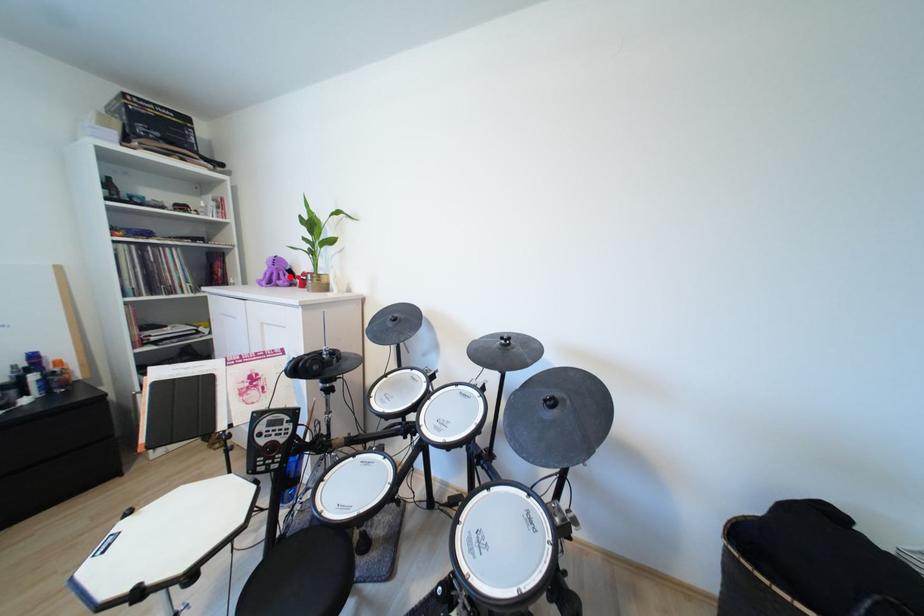
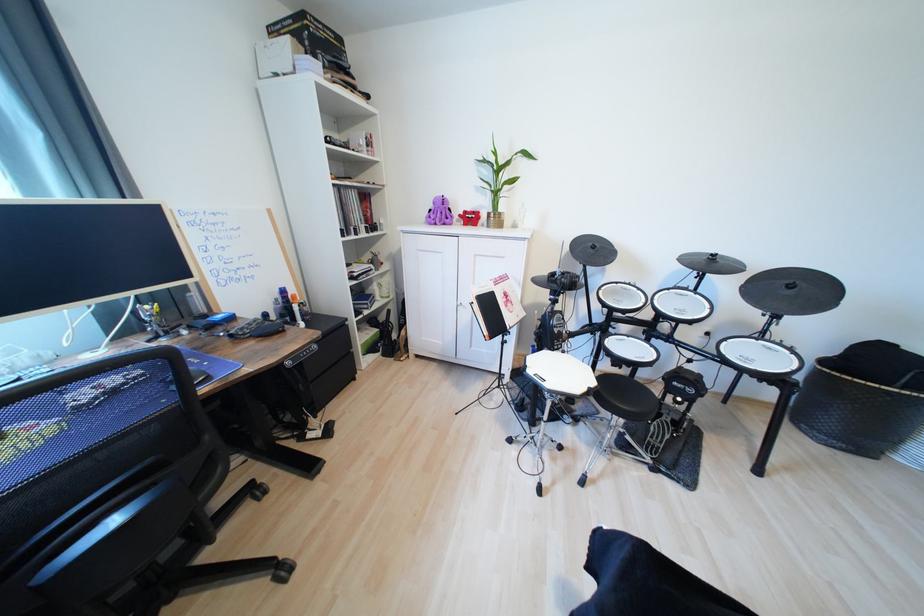
The point at the highlighted location is marked in the first image. Where is the corresponding point in the second image?

(447, 216)